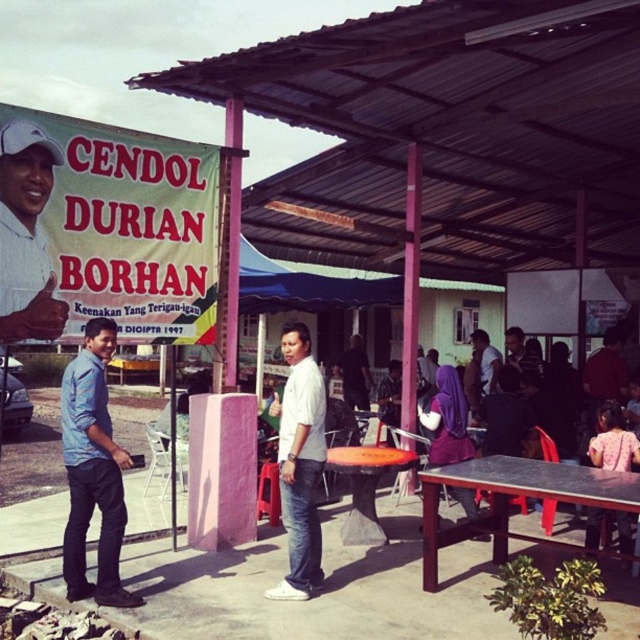
Question: Which of the following is the farthest from the observer?

Choices:
 (A) pink fabric dress at lower right
 (B) white matte shirt at center
 (C) matte white shirt at upper left
 (D) blue denim shirt at lower left

Answer: (A)

Question: Considering the relative positions of black laminate table at lower right and pink fabric dress at lower right in the image provided, where is black laminate table at lower right located with respect to pink fabric dress at lower right?

Choices:
 (A) above
 (B) below

Answer: (B)

Question: Which object appears farthest from the camera in this image?

Choices:
 (A) matte black shirt at center
 (B) black laminate table at lower right
 (C) matte white shirt at upper left

Answer: (A)

Question: Among these objects, which one is farthest from the camera?

Choices:
 (A) matte white shirt at upper left
 (B) matte white shirt at center
 (C) white matte shirt at center

Answer: (B)

Question: In this image, where is blue denim shirt at lower left located relative to matte white shirt at upper left?

Choices:
 (A) left
 (B) right

Answer: (B)

Question: Is white matte shirt at center to the right of matte black shirt at center from the viewer's perspective?

Choices:
 (A) no
 (B) yes

Answer: (A)